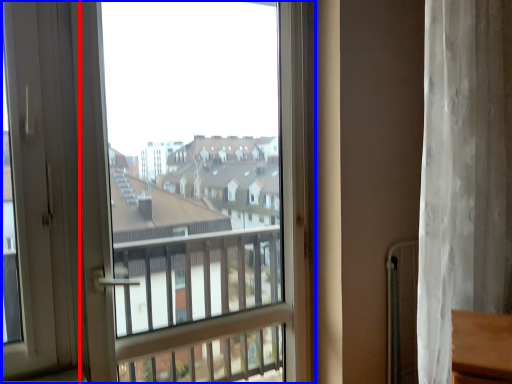
Question: Which object is closer to the camera taking this photo, screen door (highlighted by a red box) or window (highlighted by a blue box)?

Choices:
 (A) screen door
 (B) window

Answer: (A)